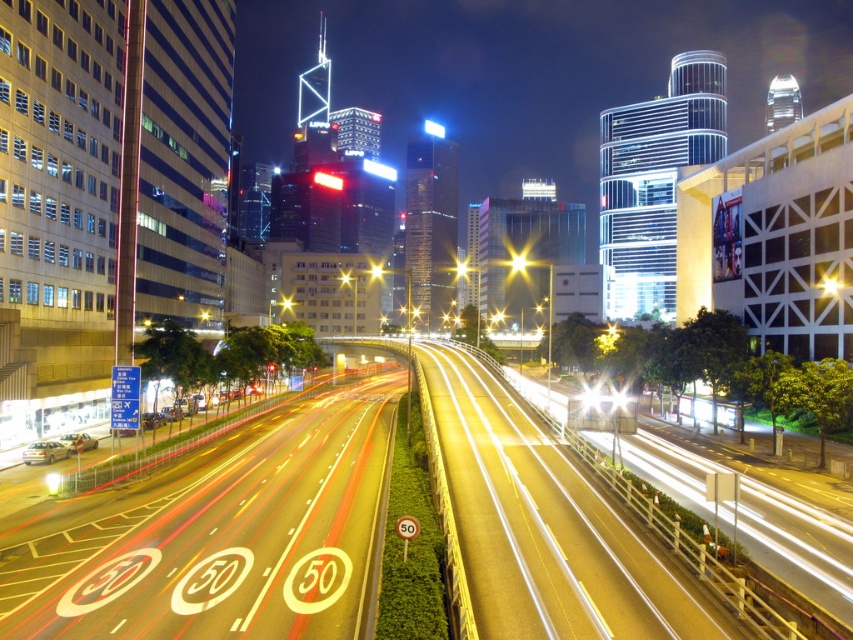
Question: Which point is farther to the camera?

Choices:
 (A) (519, 253)
 (B) (463, 260)

Answer: (B)

Question: Which of the following is the closest to the observer?

Choices:
 (A) bright yellow light at center
 (B) white glossy highway at center
 (C) yellow metallic streetlight at center
 (D) yellow asphalt highway at center

Answer: (D)

Question: Does white glossy highway at center appear on the left side of yellow metallic streetlight at center?

Choices:
 (A) yes
 (B) no

Answer: (A)

Question: Estimate the real-world distances between objects in this image. Which object is farther from the bright yellow light at center?

Choices:
 (A) yellow asphalt highway at center
 (B) yellow metallic streetlight at center
 (C) white glossy highway at center

Answer: (A)

Question: Is bright yellow light at center bigger than yellow metallic streetlight at center?

Choices:
 (A) yes
 (B) no

Answer: (A)

Question: Is yellow asphalt highway at center above bright yellow light at center?

Choices:
 (A) no
 (B) yes

Answer: (A)